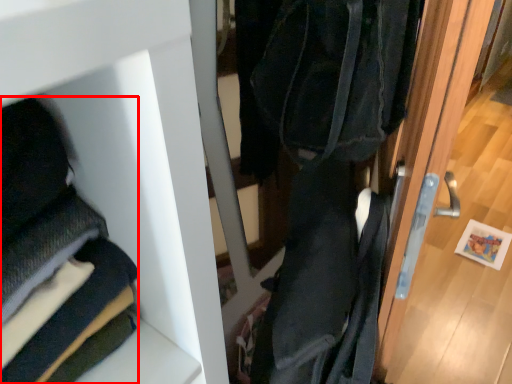
Question: Observing the image, what is the correct spatial positioning of cloak (annotated by the red box) in reference to door?

Choices:
 (A) right
 (B) left

Answer: (B)